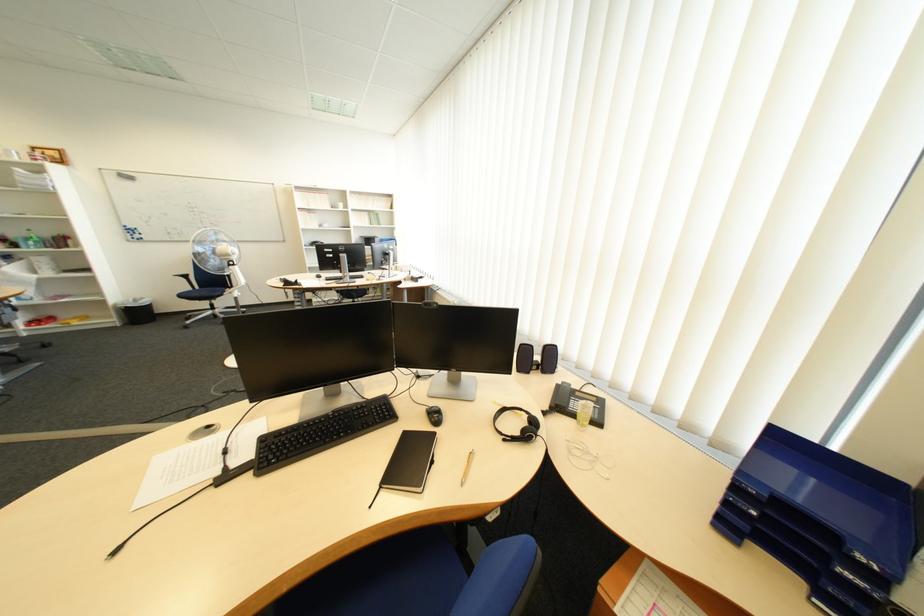
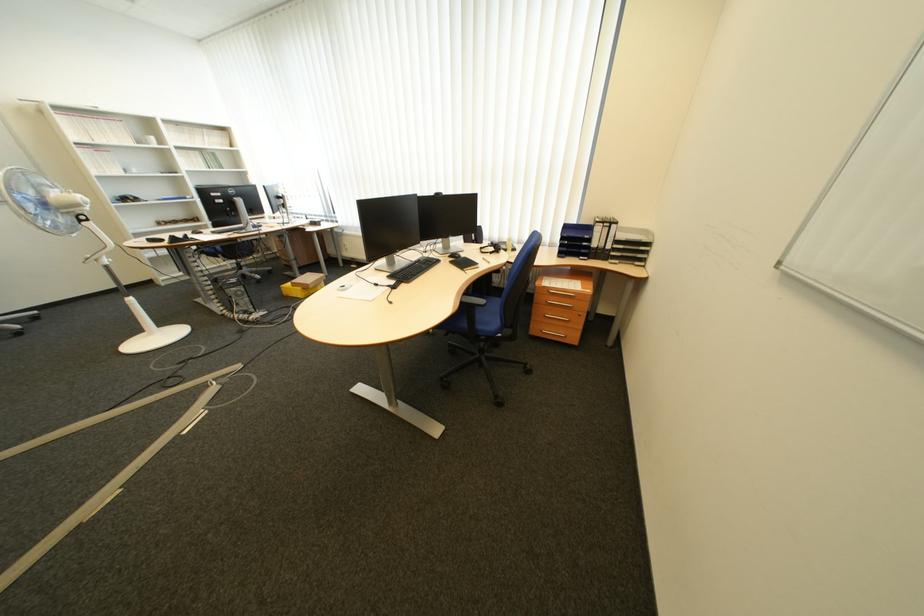
Locate, in the second image, the point that corresponds to point (767, 514) in the first image.

(579, 244)